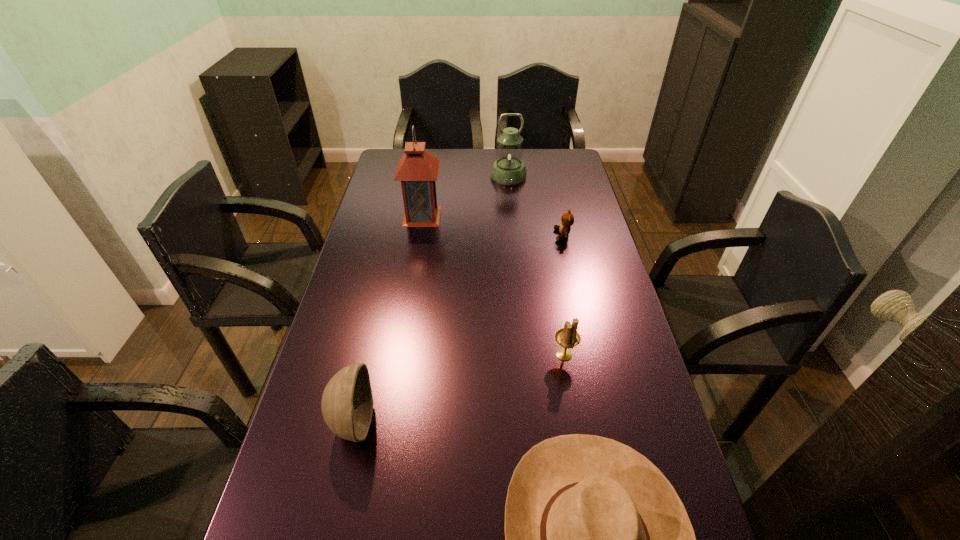
Find the location of `the left lantern`. the left lantern is located at coordinates (417, 170).

Find the location of `the nearer lantern`. the nearer lantern is located at coordinates (417, 170).

Identify the location of the farthest object. (508, 169).

At what (x,y) coordinates should I click in order to perform the action: click on the second tallest object. Please return your answer as a coordinate pair (x, y). Image resolution: width=960 pixels, height=540 pixels. Looking at the image, I should click on (508, 169).

You are a GUI agent. You are given a task and a screenshot of the screen. Output one action in this format:
    pyautogui.click(x=<x>, y=<y>)
    Task: Click on the bowl
    Image resolution: width=960 pixels, height=540 pixels.
    Given the screenshot: What is the action you would take?
    pyautogui.click(x=347, y=403)

This screenshot has height=540, width=960. Find the location of `candle holder`. candle holder is located at coordinates (568, 337).

Where is `the fourth nearest object`? the fourth nearest object is located at coordinates [x=567, y=220].

Where is `the shortest object`? This screenshot has width=960, height=540. the shortest object is located at coordinates (567, 220).

Where is `vacant space located on the right of the nearer lantern`? vacant space located on the right of the nearer lantern is located at coordinates (455, 216).

I want to click on vacant space located 0.100m on the left of the right lantern, so tap(466, 176).